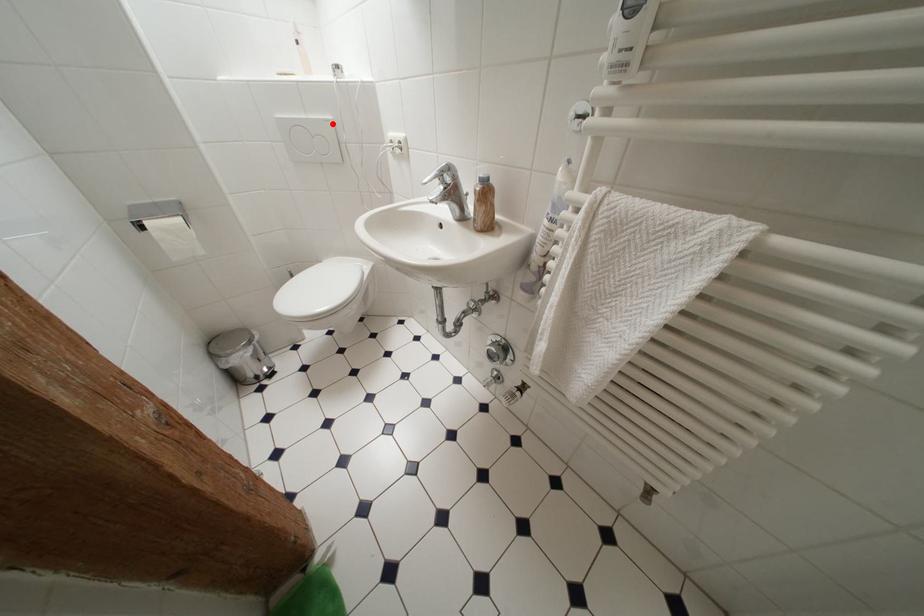
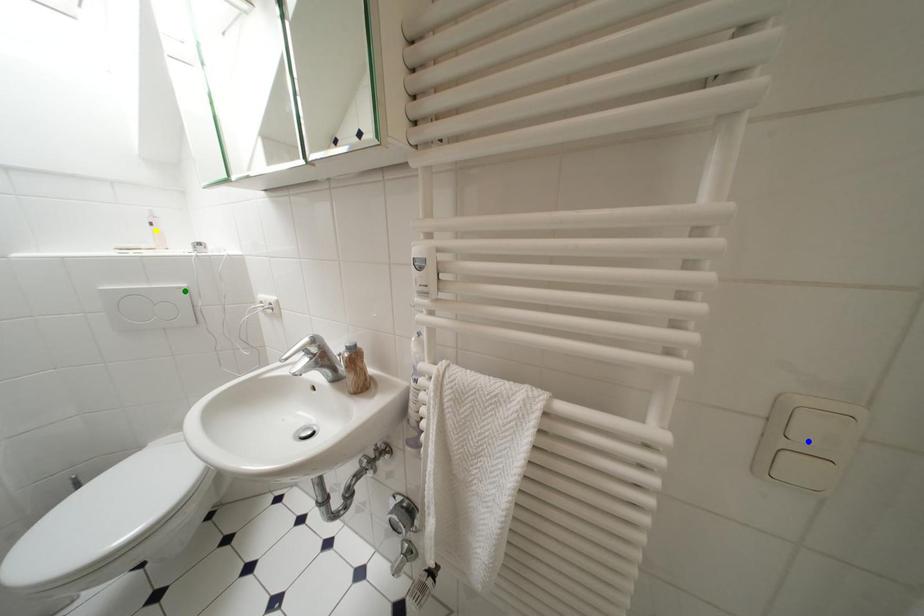
Question: I am providing you with two images of the same scene from different viewpoints. A red point is marked on the first image. You are given multiple points on the second image. Which point in image 2 represents the same 3d spot as the red point in image 1?

Choices:
 (A) yellow point
 (B) blue point
 (C) green point

Answer: (C)